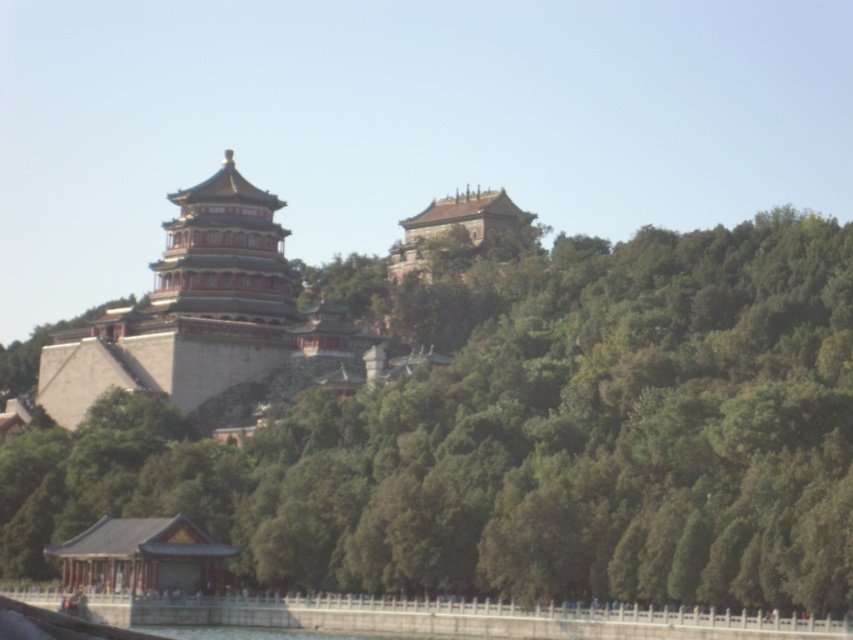
Does green leafy trees at center have a greater height compared to green stone pagoda at center?

Yes, green leafy trees at center is taller than green stone pagoda at center.

Can you confirm if green leafy trees at center is smaller than green stone pagoda at center?

No, green leafy trees at center is not smaller than green stone pagoda at center.

Where is `green leafy trees at center`? green leafy trees at center is located at coordinates (523, 436).